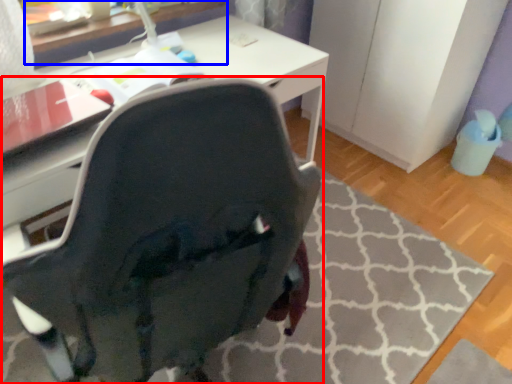
Question: Which of the following is the farthest to the observer, chair (highlighted by a red box) or table (highlighted by a blue box)?

Choices:
 (A) chair
 (B) table

Answer: (B)